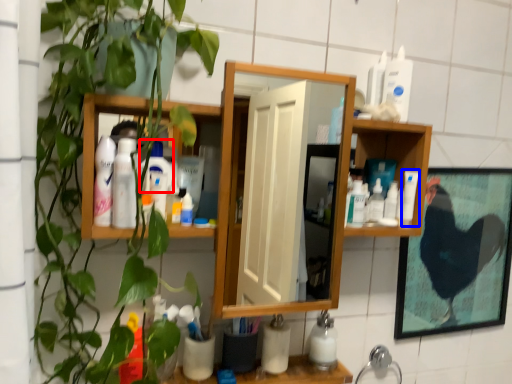
Question: Which object appears closest to the camera in this image, cleaning product (highlighted by a red box) or cleaning product (highlighted by a blue box)?

Choices:
 (A) cleaning product
 (B) cleaning product

Answer: (A)